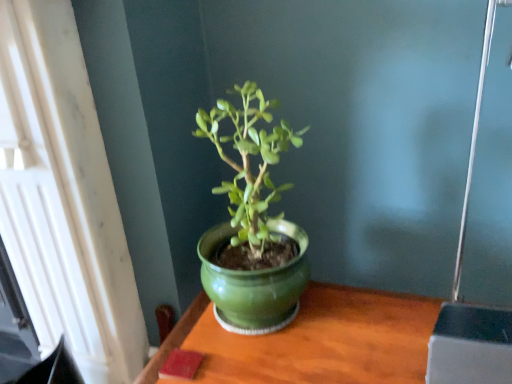
Question: Is glossy ceramic pot at center further to camera compared to green ceramic table at center?

Choices:
 (A) yes
 (B) no

Answer: (A)

Question: Is glossy ceramic pot at center next to green ceramic table at center?

Choices:
 (A) yes
 (B) no

Answer: (B)

Question: Is green ceramic table at center inside glossy ceramic pot at center?

Choices:
 (A) yes
 (B) no

Answer: (B)

Question: Does glossy ceramic pot at center have a greater width compared to green ceramic table at center?

Choices:
 (A) yes
 (B) no

Answer: (B)

Question: Is glossy ceramic pot at center to the right of green ceramic table at center from the viewer's perspective?

Choices:
 (A) yes
 (B) no

Answer: (B)

Question: Is glossy ceramic pot at center turned away from green ceramic table at center?

Choices:
 (A) no
 (B) yes

Answer: (A)

Question: From a real-world perspective, is white textured window at upper left located higher than glossy ceramic pot at center?

Choices:
 (A) no
 (B) yes

Answer: (A)

Question: Is white textured window at upper left wider than glossy ceramic pot at center?

Choices:
 (A) yes
 (B) no

Answer: (A)

Question: Is white textured window at upper left oriented away from glossy ceramic pot at center?

Choices:
 (A) no
 (B) yes

Answer: (A)

Question: Does white textured window at upper left appear on the left side of glossy ceramic pot at center?

Choices:
 (A) no
 (B) yes

Answer: (B)

Question: Is white textured window at upper left to the right of glossy ceramic pot at center from the viewer's perspective?

Choices:
 (A) no
 (B) yes

Answer: (A)

Question: Can you confirm if white textured window at upper left is smaller than glossy ceramic pot at center?

Choices:
 (A) no
 (B) yes

Answer: (A)

Question: Is white textured window at upper left outside green ceramic table at center?

Choices:
 (A) yes
 (B) no

Answer: (A)